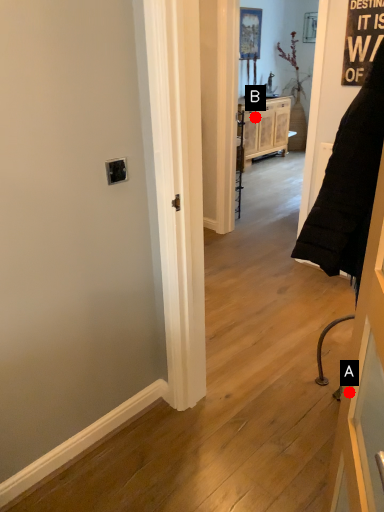
Question: Two points are circled on the image, labeled by A and B beside each circle. Which point appears farthest from the camera in this image?

Choices:
 (A) A is further
 (B) B is further

Answer: (B)